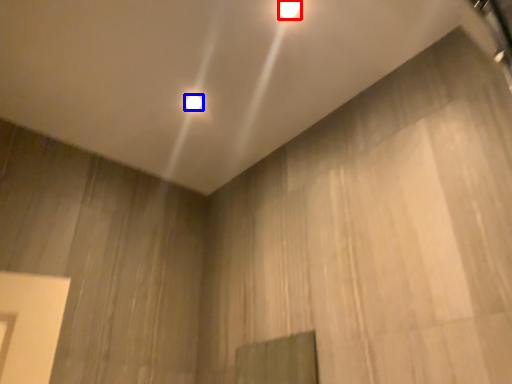
Question: Which point is closer to the camera, lamp (highlighted by a red box) or lamp (highlighted by a blue box)?

Choices:
 (A) lamp
 (B) lamp

Answer: (A)